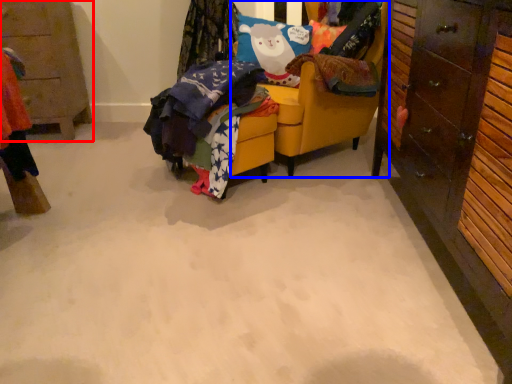
Question: Which object appears farthest to the camera in this image, cabinetry (highlighted by a red box) or chair (highlighted by a blue box)?

Choices:
 (A) cabinetry
 (B) chair

Answer: (A)